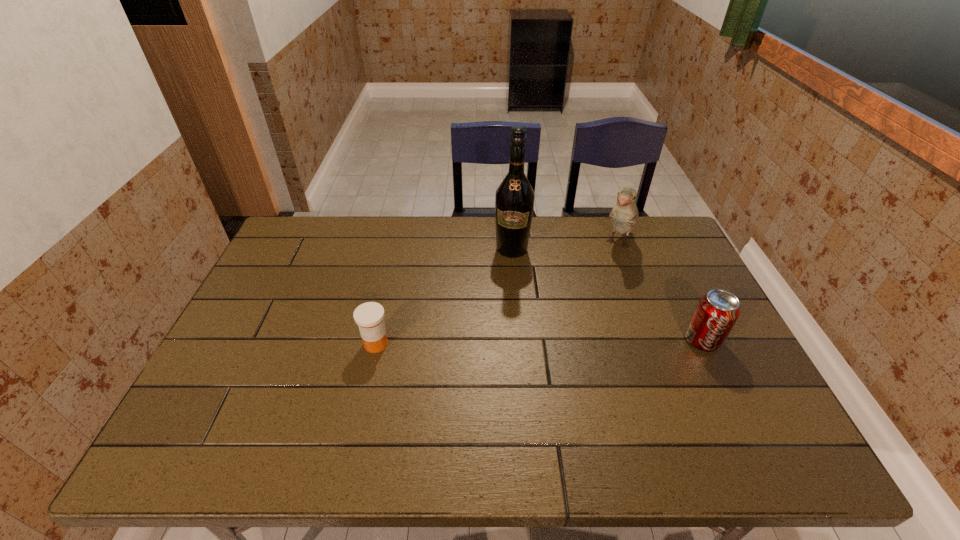
Identify the location of unoccupied area between the leftmost object and the third shortest object. The image size is (960, 540). (497, 294).

This screenshot has width=960, height=540. In order to click on vacant space that's between the medicine and the second shortest object in this screenshot , I will do [540, 342].

The width and height of the screenshot is (960, 540). In order to click on unoccupied area between the bird and the shortest object in this screenshot , I will do `click(497, 294)`.

In order to click on vacant area between the tallest object and the third tallest object in this screenshot , I will do `click(607, 295)`.

Where is `vacant area that lies between the bird and the tallest object`? The image size is (960, 540). vacant area that lies between the bird and the tallest object is located at coordinates (565, 246).

Locate an element on the screen. free area in between the third tallest object and the wine bottle is located at coordinates (607, 295).

Where is `unoccupied position between the wine bottle and the leftmost object`? unoccupied position between the wine bottle and the leftmost object is located at coordinates (444, 296).

Choose which object is the third nearest neighbor to the rightmost object. Please provide its 2D coordinates. Your answer should be formatted as a tuple, i.e. [(x, y)], where the tuple contains the x and y coordinates of a point satisfying the conditions above.

[(369, 316)]

Locate an element on the screen. This screenshot has width=960, height=540. object that stands as the closest to the shortest object is located at coordinates (514, 201).

The width and height of the screenshot is (960, 540). What are the coordinates of `vacant space that satisfies the following two spatial constraints: 1. on the front side of the rightmost object; 2. on the right side of the third object from left to right` in the screenshot? It's located at (655, 341).